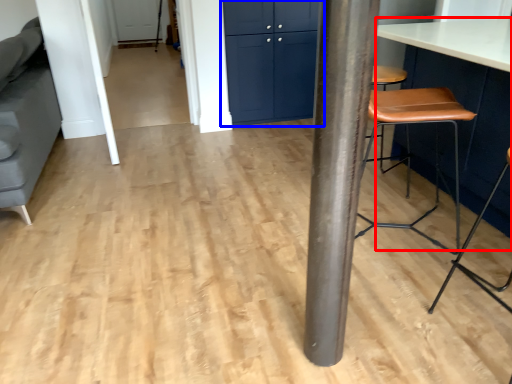
Question: Among these objects, which one is farthest to the camera, table (highlighted by a red box) or cabinetry (highlighted by a blue box)?

Choices:
 (A) table
 (B) cabinetry

Answer: (B)